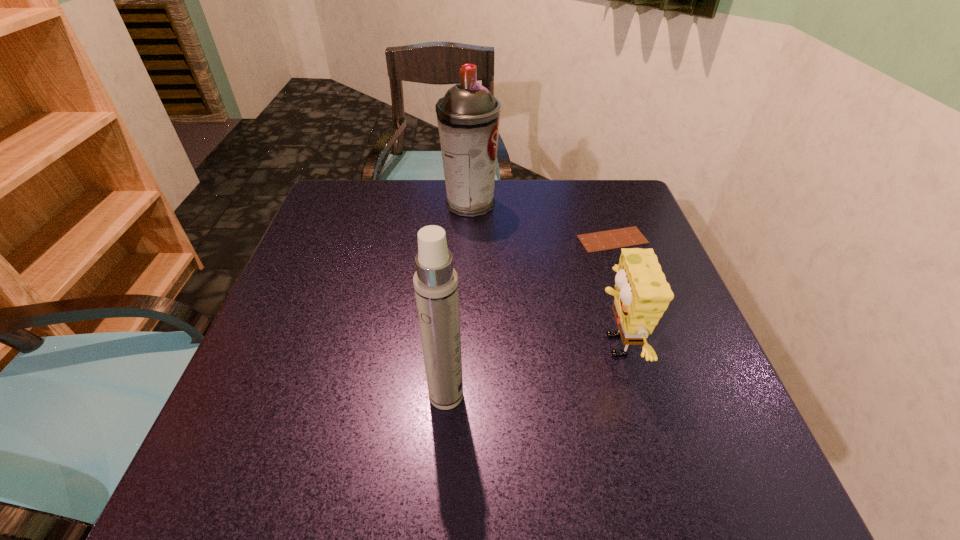
Where is `vacant space that satisfies the following two spatial constraints: 1. on the back side of the shortest object; 2. on the left side of the nearer aerosol can`? This screenshot has width=960, height=540. vacant space that satisfies the following two spatial constraints: 1. on the back side of the shortest object; 2. on the left side of the nearer aerosol can is located at coordinates (456, 240).

This screenshot has height=540, width=960. Find the location of `free spot that satisfies the following two spatial constraints: 1. on the front side of the second farthest object; 2. on the front-facing side of the sponge`. free spot that satisfies the following two spatial constraints: 1. on the front side of the second farthest object; 2. on the front-facing side of the sponge is located at coordinates (650, 346).